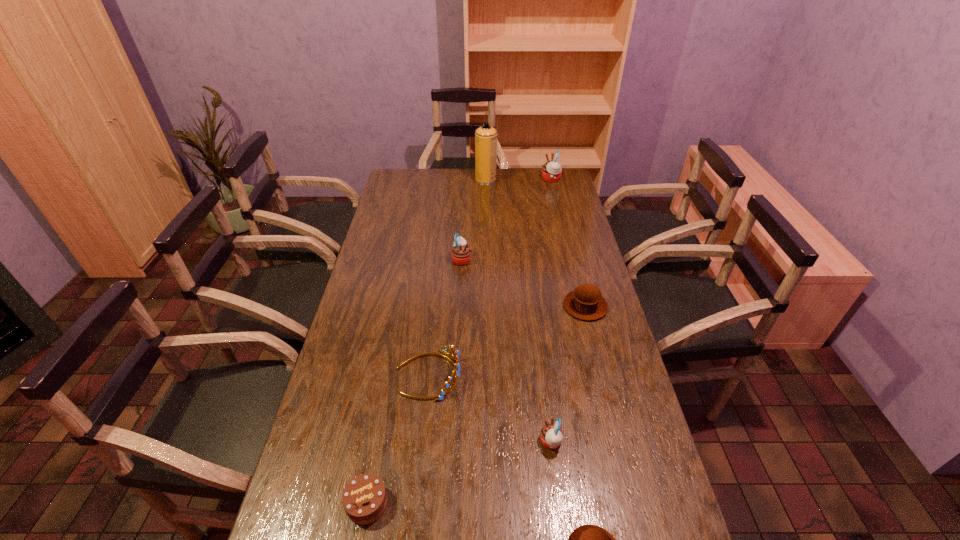
Find the location of a particular element. The width and height of the screenshot is (960, 540). the fifth object from right to left is located at coordinates (485, 136).

Image resolution: width=960 pixels, height=540 pixels. I want to click on aerosol can, so click(485, 136).

Identify the location of the seventh shortest object. (551, 171).

Locate an element on the screen. This screenshot has height=540, width=960. the tallest muffin is located at coordinates (551, 171).

Image resolution: width=960 pixels, height=540 pixels. Identify the location of the second farthest muffin. (461, 253).

This screenshot has width=960, height=540. I want to click on the leftmost muffin, so click(461, 253).

This screenshot has height=540, width=960. Find the location of `the fourth nearest object`. the fourth nearest object is located at coordinates (447, 349).

Where is `tiara`? The image size is (960, 540). tiara is located at coordinates (447, 349).

I want to click on the smallest pink muffin, so click(551, 435).

Locate an element on the screen. The height and width of the screenshot is (540, 960). the fourth farthest muffin is located at coordinates (551, 435).